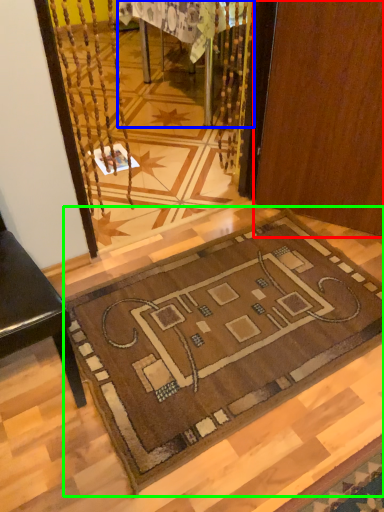
Question: Which object is the closest to the door (highlighted by a red box)? Choose among these: table (highlighted by a blue box) or mat (highlighted by a green box).

Choices:
 (A) table
 (B) mat

Answer: (B)